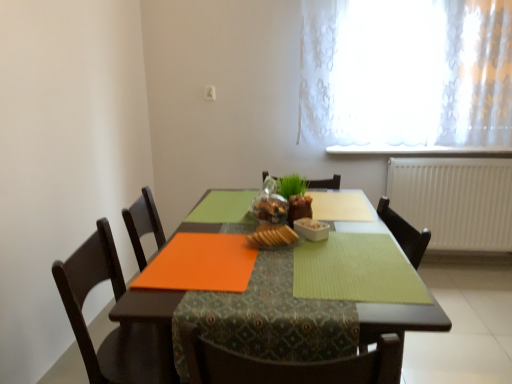
This screenshot has width=512, height=384. What do you see at coordinates (116, 301) in the screenshot? I see `dark wood chair at lower left` at bounding box center [116, 301].

I want to click on white plastic radiator at right, so click(x=455, y=200).

Image resolution: width=512 pixels, height=384 pixels. Describe the element at coordinates (356, 270) in the screenshot. I see `green textured placemat at center, the 2th place mat viewed from the left` at that location.

What do you see at coordinates (200, 264) in the screenshot?
I see `orange matte placemat at center, which is counted as the first place mat, starting from the left` at bounding box center [200, 264].

I want to click on translucent fabric at upper right, so click(x=406, y=74).

Considering the positions of objects green textured placemat at center, which ranks as the first place mat in right-to-left order, and slightly toasted bread at center in the image provided, who is more to the left, green textured placemat at center, which ranks as the first place mat in right-to-left order, or slightly toasted bread at center?

From the viewer's perspective, slightly toasted bread at center appears more on the left side.

Which object is thinner, green textured placemat at center, which ranks as the first place mat in right-to-left order, or slightly toasted bread at center?

With smaller width is slightly toasted bread at center.

From the image's perspective, which object appears higher, green textured placemat at center, the 2th place mat viewed from the left, or slightly toasted bread at center?

slightly toasted bread at center.

Is slightly toasted bread at center with white glossy bowl at center?

Absolutely, slightly toasted bread at center is next to and touching white glossy bowl at center.

From a real-world perspective, is slightly toasted bread at center physically below white glossy bowl at center?

Actually, slightly toasted bread at center is physically above white glossy bowl at center in the real world.

From the image's perspective, does slightly toasted bread at center appear higher than white glossy bowl at center?

No.

Considering the sizes of objects slightly toasted bread at center and white glossy bowl at center in the image provided, who is smaller, slightly toasted bread at center or white glossy bowl at center?

white glossy bowl at center.

From the image's perspective, which one is positioned higher, dark wood chair at lower left or slightly toasted bread at center?

slightly toasted bread at center, from the image's perspective.

Can you tell me how much dark wood chair at lower left and slightly toasted bread at center differ in facing direction?

The angle between the facing direction of dark wood chair at lower left and the facing direction of slightly toasted bread at center is 2.68 degrees.

From a real-world perspective, is dark wood chair at lower left beneath slightly toasted bread at center?

Yes.

Based on their sizes in the image, would you say dark wood chair at lower left is bigger or smaller than slightly toasted bread at center?

Considering their sizes, dark wood chair at lower left takes up more space than slightly toasted bread at center.

Does white glossy bowl at center have a lesser width compared to white plastic radiator at right?

Correct, the width of white glossy bowl at center is less than that of white plastic radiator at right.

From the image's perspective, is white glossy bowl at center over white plastic radiator at right?

Actually, white glossy bowl at center appears below white plastic radiator at right in the image.

In the scene shown: In terms of size, does translucent fabric at upper right appear bigger or smaller than white glossy bowl at center?

In the image, translucent fabric at upper right appears to be larger than white glossy bowl at center.

Considering the positions of point (347, 126) and point (328, 228), is point (347, 126) closer or farther from the camera than point (328, 228)?

Point (347, 126) is farther from the camera than point (328, 228).

Is translucent fabric at upper right facing away from white glossy bowl at center?

No, translucent fabric at upper right's orientation is not away from white glossy bowl at center.

From the picture: Is the position of white glossy bowl at center less distant than that of translucent fabric at upper right?

Yes.

This screenshot has height=384, width=512. I want to click on tableware located in front of the translucent fabric at upper right, so click(x=311, y=229).

Is white glossy bowl at center far away from translucent fabric at upper right?

Yes, white glossy bowl at center and translucent fabric at upper right are quite far apart.

From a real-world perspective, which object stands above the other?

translucent fabric at upper right, from a real-world perspective.

From a real-world perspective, between orange matte placemat at center and white plastic radiator at right, who is vertically higher?

white plastic radiator at right, from a real-world perspective.

Looking at their sizes, would you say orange matte placemat at center is wider or thinner than white plastic radiator at right?

Considering their sizes, orange matte placemat at center looks broader than white plastic radiator at right.

Based on the photo, is orange matte placemat at center aimed at white plastic radiator at right?

No, orange matte placemat at center is not oriented towards white plastic radiator at right.

Does point (189, 227) come closer to viewer compared to point (445, 241)?

Yes, point (189, 227) is in front of point (445, 241).

The height and width of the screenshot is (384, 512). What are the coordinates of `food behind the green textured placemat at center, the 2th place mat viewed from the left` in the screenshot? It's located at (272, 236).

This screenshot has height=384, width=512. I want to click on food in front of the white glossy bowl at center, so click(272, 236).

Considering their positions, is translucent fabric at upper right positioned closer to green textured placemat at center, the 2th place mat viewed from the left, than slightly toasted bread at center?

The object closer to green textured placemat at center, the 2th place mat viewed from the left, is slightly toasted bread at center.

From the image, which object appears to be farther from white plastic radiator at right, green textured placemat at center, the 2th place mat viewed from the left, or orange matte placemat at center, the second place mat in the right-to-left sequence?

orange matte placemat at center, the second place mat in the right-to-left sequence, is further to white plastic radiator at right.

Based on their spatial positions, is orange matte placemat at center or green textured placemat at center, which ranks as the first place mat in right-to-left order, further from white glossy bowl at center?

orange matte placemat at center is positioned further to the anchor white glossy bowl at center.

Looking at the image, which one is located further to translucent fabric at upper right, slightly toasted bread at center or white plastic radiator at right?

slightly toasted bread at center lies further to translucent fabric at upper right than the other object.

Looking at the image, which one is located closer to white glossy bowl at center, dark wood chair at lower left or white plastic radiator at right?

Among the two, dark wood chair at lower left is located nearer to white glossy bowl at center.

Estimate the real-world distances between objects in this image. Which object is closer to green textured placemat at center, the 2th place mat viewed from the left, white glossy bowl at center or orange matte placemat at center, the second place mat in the right-to-left sequence?

white glossy bowl at center is closer to green textured placemat at center, the 2th place mat viewed from the left.

From the image, which object appears to be nearer to dark wood chair at lower left, white glossy bowl at center or translucent fabric at upper right?

white glossy bowl at center.

Looking at the image, which one is located closer to orange matte placemat at center, slightly toasted bread at center or white plastic radiator at right?

slightly toasted bread at center lies closer to orange matte placemat at center than the other object.

At what (x,y) coordinates should I click in order to perform the action: click on food between orange matte placemat at center, the second place mat in the right-to-left sequence, and translucent fabric at upper right from front to back. Please return your answer as a coordinate pair (x, y). The width and height of the screenshot is (512, 384). Looking at the image, I should click on (272, 236).

I want to click on food between dark wood chair at lower left and translucent fabric at upper right along the z-axis, so click(272, 236).

Locate an element on the screen. The width and height of the screenshot is (512, 384). food located between green textured placemat at center, the 2th place mat viewed from the left, and translucent fabric at upper right in the depth direction is located at coordinates (272, 236).

Identify the location of tableware located between green textured placemat at center, which ranks as the first place mat in right-to-left order, and translucent fabric at upper right in the depth direction. (311, 229).